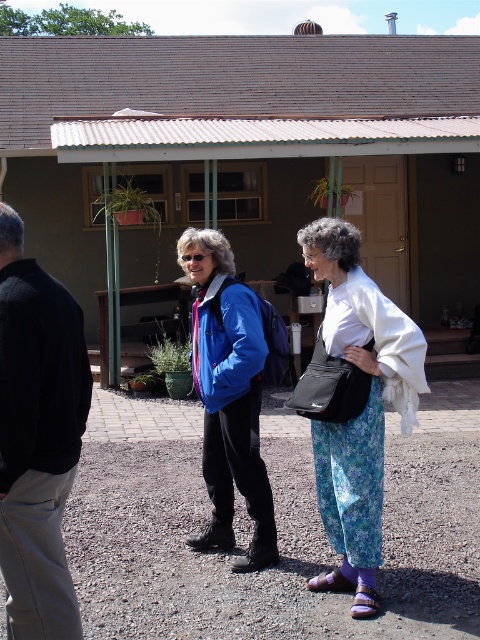
Is black cotton pants at lower left further to the viewer compared to blue fabric jacket at center?

No, it is not.

Is black cotton pants at lower left in front of blue fabric jacket at center?

Yes.

Consider the image. Who is more forward, (17, 259) or (225, 442)?

Point (17, 259)

The image size is (480, 640). Find the location of `black cotton pants at lower left`. black cotton pants at lower left is located at coordinates (37, 436).

Which is more to the left, floral fabric pants at center or blue fabric jacket at center?

Positioned to the left is blue fabric jacket at center.

Does floral fabric pants at center have a greater height compared to blue fabric jacket at center?

Yes.

Locate an element on the screen. This screenshot has height=640, width=480. floral fabric pants at center is located at coordinates (360, 406).

Image resolution: width=480 pixels, height=640 pixels. Identify the location of floral fabric pants at center. (360, 406).

Can you confirm if black cotton pants at lower left is wider than floral fabric pants at center?

No.

Does black cotton pants at lower left have a lesser width compared to floral fabric pants at center?

Yes, black cotton pants at lower left is thinner than floral fabric pants at center.

Who is more distant from viewer, (32, 321) or (348, 451)?

Point (348, 451)

At what (x,y) coordinates should I click in order to perform the action: click on black cotton pants at lower left. Please return your answer as a coordinate pair (x, y). Looking at the image, I should click on (37, 436).